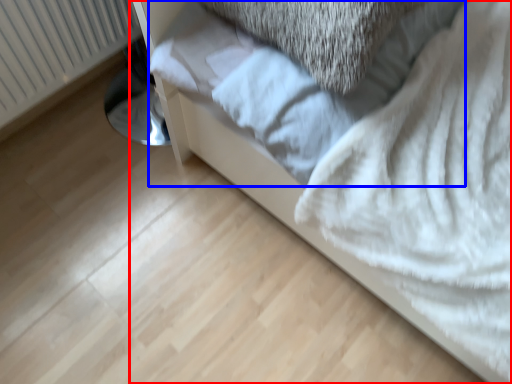
Question: Which point is closer to the camera, furniture (highlighted by a red box) or sheet (highlighted by a blue box)?

Choices:
 (A) furniture
 (B) sheet

Answer: (A)